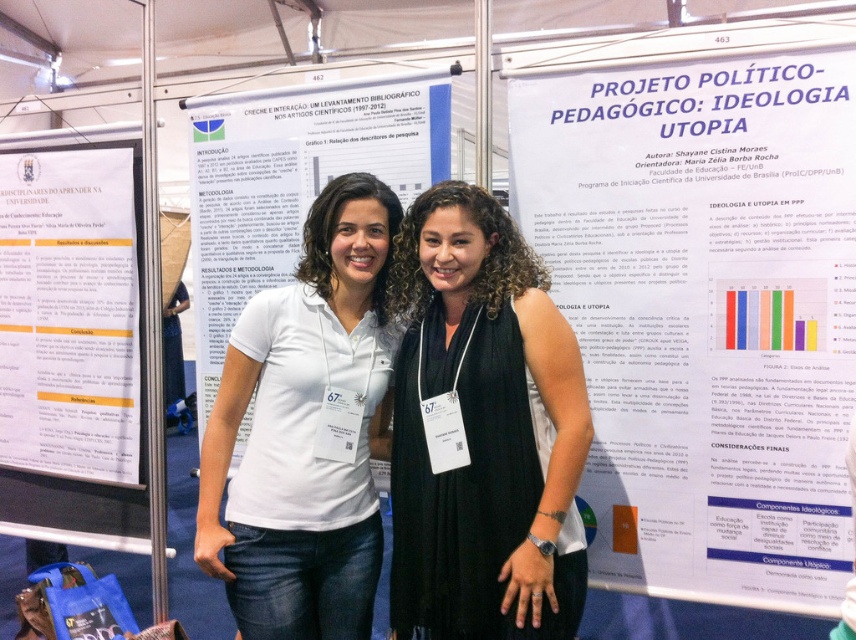
Can you confirm if white cotton polo shirt at center is positioned below white paper poster at left?

Yes, white cotton polo shirt at center is below white paper poster at left.

At what (x,y) coordinates should I click in order to perform the action: click on white cotton polo shirt at center. Please return your answer as a coordinate pair (x, y). This screenshot has height=640, width=856. Looking at the image, I should click on (305, 429).

Between point (260, 406) and point (30, 365), which one is positioned behind?

Point (30, 365)

Where is `white cotton polo shirt at center`? white cotton polo shirt at center is located at coordinates (305, 429).

Who is more forward, (108,365) or (328,157)?

Point (328,157) is in front.

Does point (125, 340) come in front of point (406, 163)?

No, (125, 340) is further to viewer.

Measure the distance between white paper poster at left and camera.

white paper poster at left and camera are 8.52 feet apart.

Identify the location of white paper poster at left. [69, 314].

Measure the distance between white paper at upper center and white cotton polo shirt at center.

white paper at upper center is 29.91 inches away from white cotton polo shirt at center.

Is white paper at upper center below white cotton polo shirt at center?

No.

Measure the distance between white paper at upper center and camera.

1.90 meters

Locate an element on the screen. This screenshot has width=856, height=640. white paper at upper center is located at coordinates (704, 314).